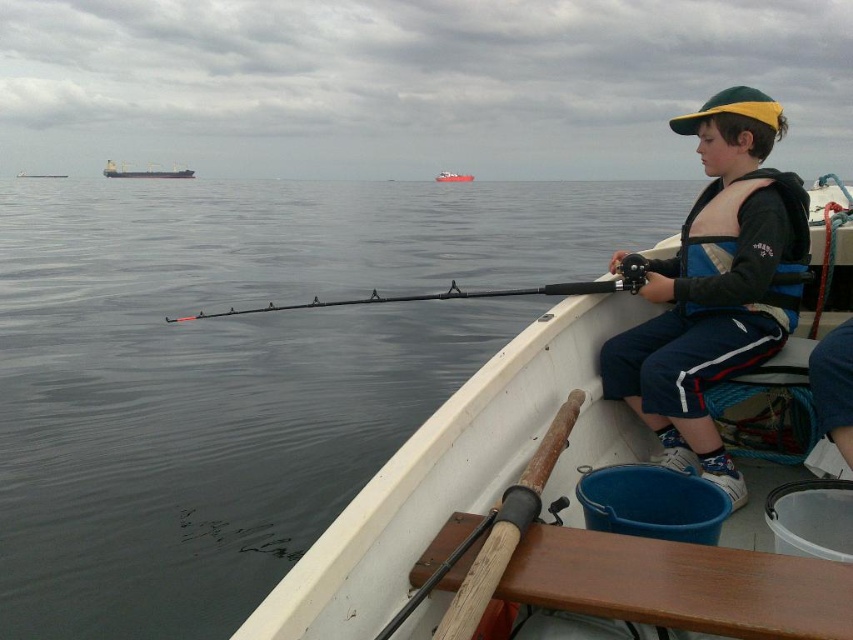
Does red glossy boat at center have a greater height compared to metallic gray boat at left?

Incorrect, red glossy boat at center's height is not larger of metallic gray boat at left's.

Does point (442, 172) come behind point (45, 176)?

No, (442, 172) is closer to viewer.

What do you see at coordinates (451, 177) in the screenshot?
I see `red glossy boat at center` at bounding box center [451, 177].

Where is `red glossy boat at center`? red glossy boat at center is located at coordinates (x=451, y=177).

Which is more to the right, smooth water at center or red glossy boat at center?

Positioned to the right is red glossy boat at center.

Which is behind, point (412, 337) or point (438, 180)?

The point (438, 180) is behind.

Where is `smooth water at center`? This screenshot has height=640, width=853. smooth water at center is located at coordinates (225, 365).

Between smooth water at center and blue life vest at center, which one appears on the right side from the viewer's perspective?

blue life vest at center

Is point (126, 257) farther from viewer compared to point (683, 465)?

Yes.

This screenshot has width=853, height=640. What are the coordinates of `smooth water at center` in the screenshot? It's located at (225, 365).